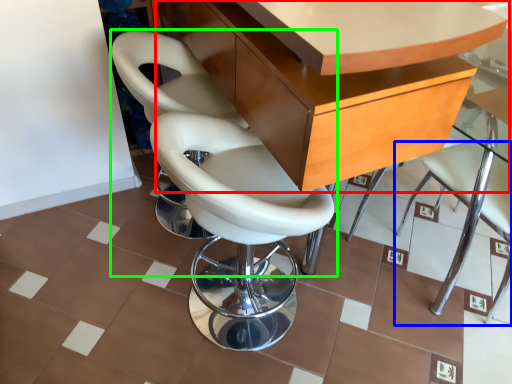
Question: Based on their relative distances, which object is farther from table (highlighted by a red box)? Choose from chair (highlighted by a blue box) and chair (highlighted by a green box).

Choices:
 (A) chair
 (B) chair

Answer: (A)